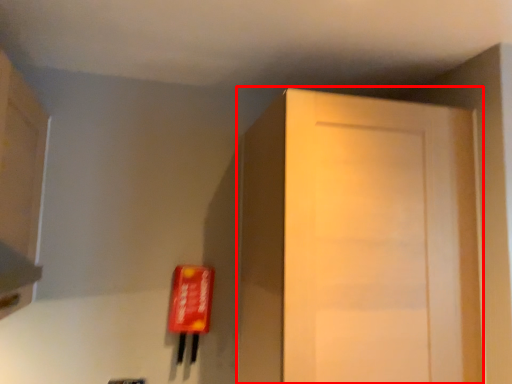
Question: Where is door (annotated by the red box) located in relation to cabinetry in the image?

Choices:
 (A) right
 (B) left

Answer: (A)